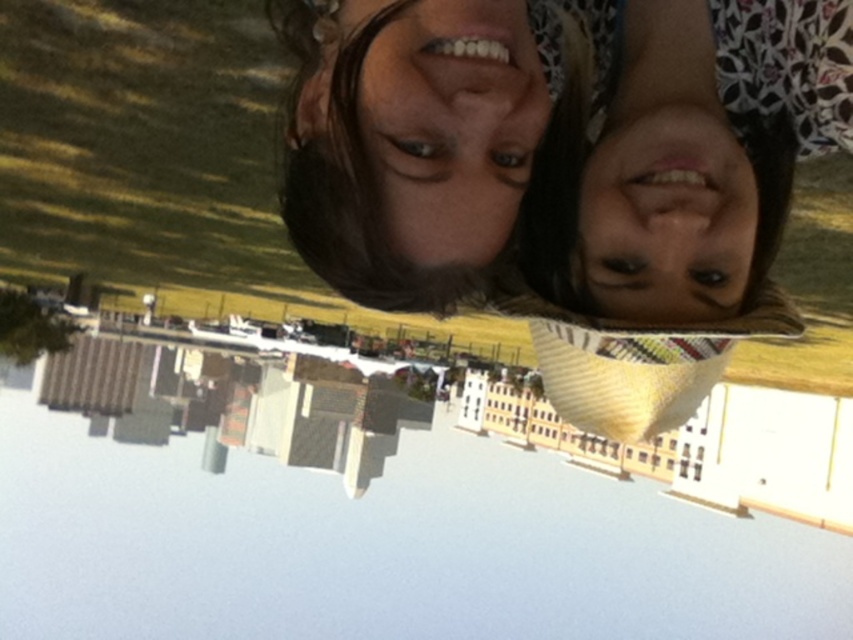
Question: Can you confirm if white glossy lake at center is positioned to the right of matte black hair at center?

Choices:
 (A) no
 (B) yes

Answer: (A)

Question: Which point appears closest to the camera in this image?

Choices:
 (A) (322, 230)
 (B) (215, 518)

Answer: (A)

Question: From the image, what is the correct spatial relationship of white glossy lake at center in relation to matte black hair at center?

Choices:
 (A) right
 (B) left

Answer: (B)

Question: Which of the following is the farthest from the observer?

Choices:
 (A) white glossy lake at center
 (B) matte black hair at center

Answer: (A)

Question: Is white glossy lake at center closer to camera compared to matte black hair at center?

Choices:
 (A) yes
 (B) no

Answer: (B)